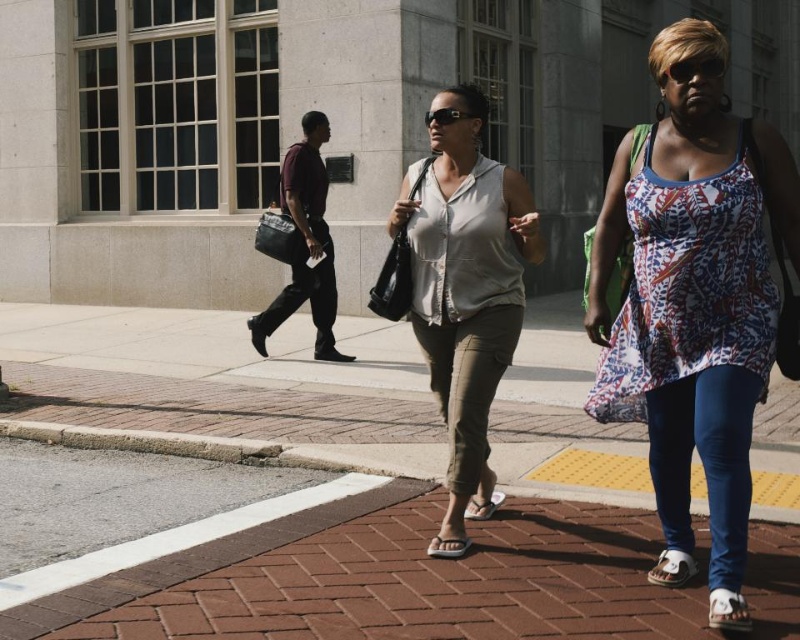
Between printed fabric tank top at center and dark maroon fabric bag at center, which one is positioned lower?

printed fabric tank top at center

Does printed fabric tank top at center have a lesser height compared to dark maroon fabric bag at center?

In fact, printed fabric tank top at center may be taller than dark maroon fabric bag at center.

Which is behind, point (717, 403) or point (320, 298)?

Point (320, 298)

The height and width of the screenshot is (640, 800). Find the location of `printed fabric tank top at center`. printed fabric tank top at center is located at coordinates (694, 300).

Consider the image. Can you confirm if matte gray shirt at center is positioned to the left of dark maroon fabric bag at center?

No, matte gray shirt at center is not to the left of dark maroon fabric bag at center.

Is point (448, 90) in front of point (304, 196)?

Yes.

Where is `matte gray shirt at center`? This screenshot has width=800, height=640. matte gray shirt at center is located at coordinates (466, 291).

How distant is printed fabric tank top at center from matte gray shirt at center?

A distance of 30.33 inches exists between printed fabric tank top at center and matte gray shirt at center.

What do you see at coordinates (694, 300) in the screenshot? This screenshot has height=640, width=800. I see `printed fabric tank top at center` at bounding box center [694, 300].

This screenshot has width=800, height=640. I want to click on printed fabric tank top at center, so click(694, 300).